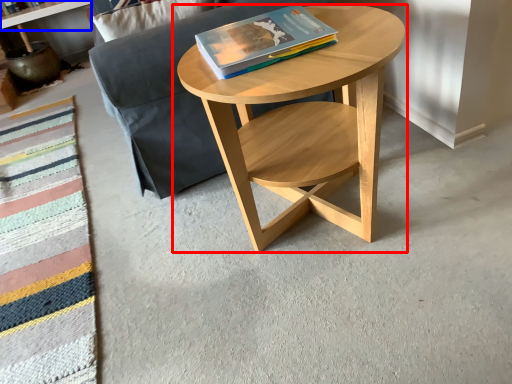
Question: Which of the following is the farthest to the observer, coffee table (highlighted by a red box) or shelf (highlighted by a blue box)?

Choices:
 (A) coffee table
 (B) shelf

Answer: (B)